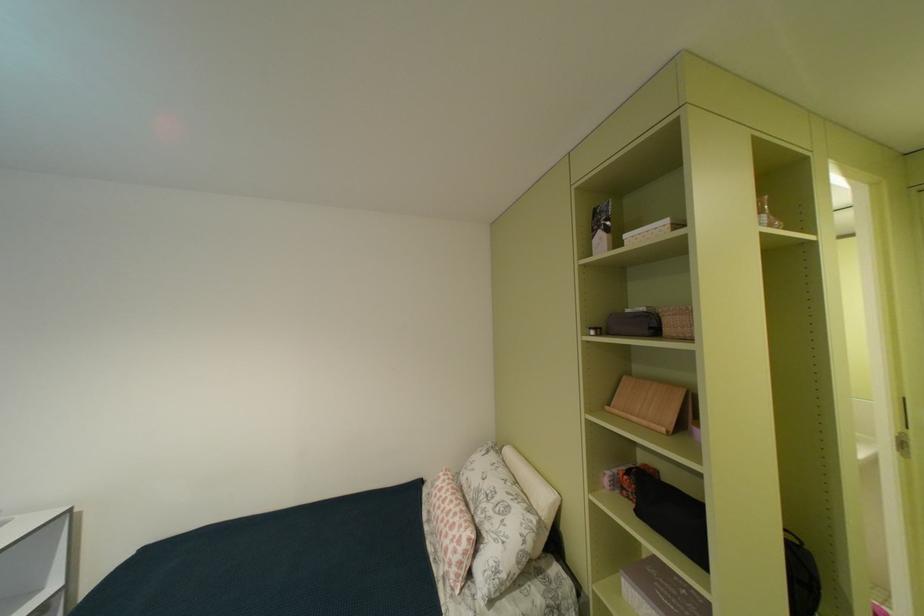
Identify the location of silver door handle. The image size is (924, 616). (903, 432).